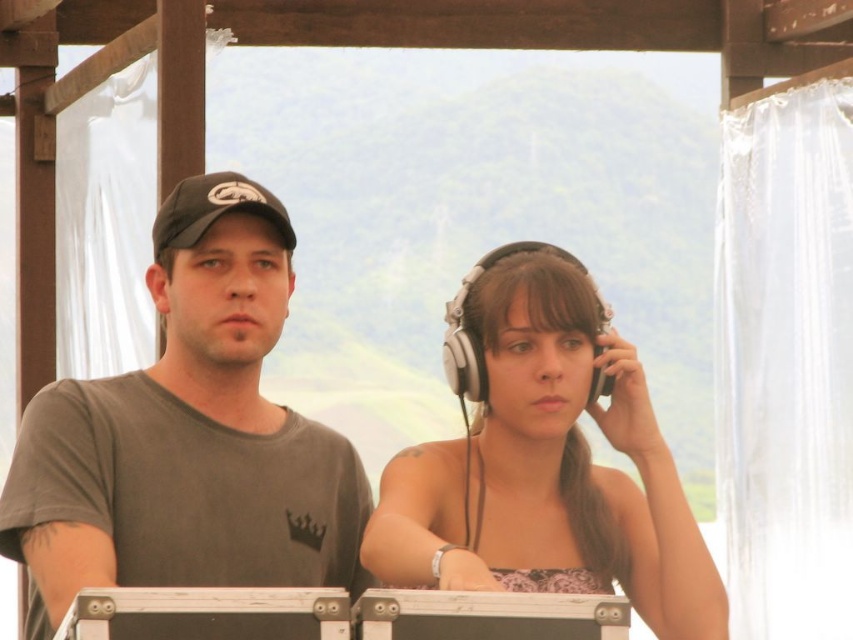
Which is below, gray matte t-shirt at center or matte black baseball cap at left?

gray matte t-shirt at center is lower down.

Does gray matte t-shirt at center have a smaller size compared to matte black baseball cap at left?

No.

Describe the element at coordinates (189, 435) in the screenshot. I see `gray matte t-shirt at center` at that location.

Identify the location of gray matte t-shirt at center. (189, 435).

Who is shorter, gray matte t-shirt at center or satin beige headphones at center?

Standing shorter between the two is gray matte t-shirt at center.

Does gray matte t-shirt at center have a lesser height compared to satin beige headphones at center?

Indeed, gray matte t-shirt at center has a lesser height compared to satin beige headphones at center.

Is point (204, 256) closer to viewer compared to point (463, 448)?

Yes, point (204, 256) is closer to viewer.

Where is `gray matte t-shirt at center`? gray matte t-shirt at center is located at coordinates (189, 435).

Can you confirm if satin beige headphones at center is bigger than matte black baseball cap at left?

Yes, satin beige headphones at center is bigger than matte black baseball cap at left.

Find the location of a particular element. This screenshot has width=853, height=640. satin beige headphones at center is located at coordinates (547, 465).

Find the location of a particular element. satin beige headphones at center is located at coordinates click(547, 465).